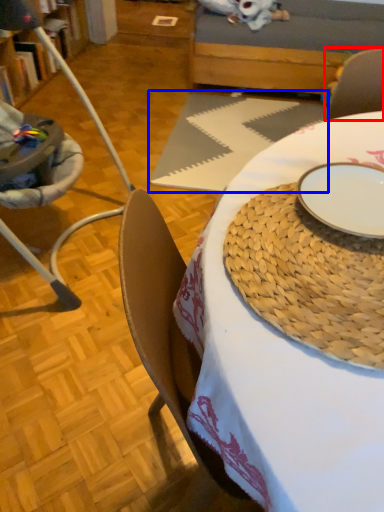
Question: Which object is closer to the camera taking this photo, armchair (highlighted by a red box) or tablecloth (highlighted by a blue box)?

Choices:
 (A) armchair
 (B) tablecloth

Answer: (B)